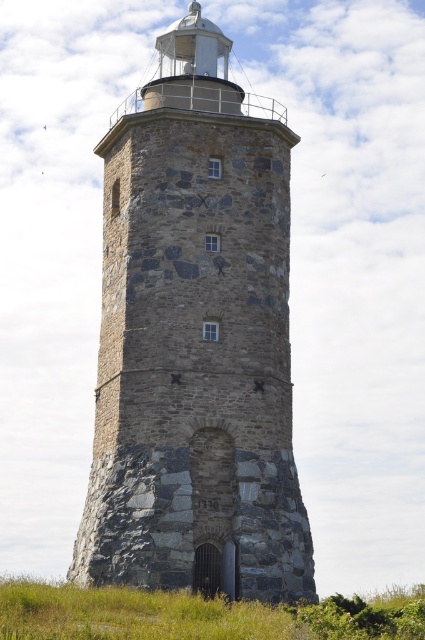
You are a maintenance worker approaching the lighthouse from the front. You need to reach the entrance at the base of the gray stone tower at center. Is the green grass at lower center blocking your path to the entrance?

The green grass at lower center is behind the gray stone tower at center, so it is not blocking the path to the entrance. You can approach the entrance directly without any obstruction from the grass.

You are standing at the green grass at lower center and want to reach the gray stone tower at center. Which direction should you walk to get there?

You should walk to the right from the green grass at lower center to reach the gray stone tower at center because the gray stone tower at center is located to the right of the green grass at lower center.

You are a drone operator trying to fly a drone between the two points marked as point (121, 243) and point (175, 628) on the lighthouse. Since the lighthouse is cylindrical, the path between them curves around the structure. Which point should the drone approach first to ensure it stays closer to the lighthouse and avoids flying into open space?

The drone should approach point (121, 243) first because it is closer to the viewer, meaning it is positioned in front of the lighthouse. Starting from this point allows the drone to navigate along the lighthouse surface, maintaining proximity to the structure and avoiding open space. The other point, (175, 628), is further away from the viewer and located behind the lighthouse, so approaching it second ensures the path stays near the lighthouse.